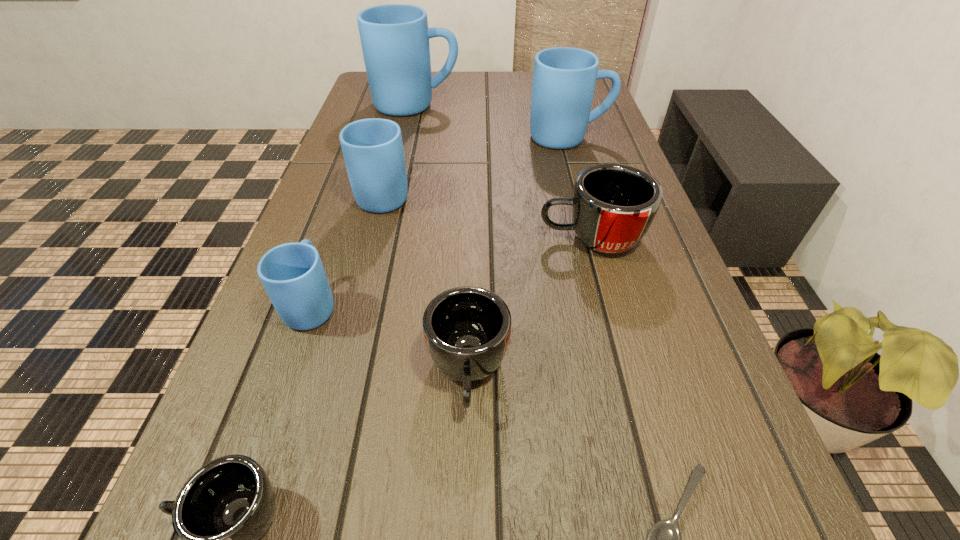
Identify the location of vacant space located 0.320m on the side of the smallest blue mug with the handle. This screenshot has width=960, height=540. (354, 183).

This screenshot has width=960, height=540. I want to click on vacant space located on the side of the second nearest red mug with the handle, so coord(466,489).

Identify the location of object present at the far edge. (395, 38).

Identify the location of object located in the far left corner section of the desktop. coord(395,38).

Find the location of a particular element. The height and width of the screenshot is (540, 960). free space at the far edge of the desktop is located at coordinates (517, 76).

Where is `blank space at the left edge of the desktop`? This screenshot has height=540, width=960. blank space at the left edge of the desktop is located at coordinates (347, 169).

This screenshot has width=960, height=540. What are the coordinates of `free space at the right edge` in the screenshot? It's located at (660, 395).

Locate an element on the screen. vacant space that's between the third farthest blue mug and the second red mug from left to right is located at coordinates (426, 282).

You are a GUI agent. You are given a task and a screenshot of the screen. Output one action in this format:
    pyautogui.click(x=<x>, y=<y>)
    Task: Click on the object that stands as the third closest to the second farthest red mug
    
    Given the screenshot: What is the action you would take?
    pyautogui.click(x=293, y=275)

Locate which object is the third closest to the farthest blue mug. Please provide its 2D coordinates. Your answer should be formatted as a tuple, i.e. [(x, y)], where the tuple contains the x and y coordinates of a point satisfying the conditions above.

[(613, 205)]